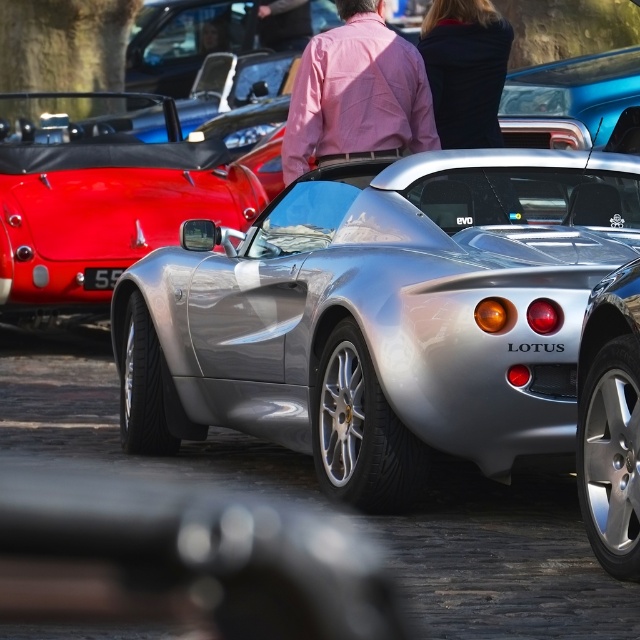
You are attending a car show and see a person wearing a pink cotton shirt at center and a black matte jacket at upper center. Which clothing item is bigger in size?

The pink cotton shirt at center is larger in size compared to the black matte jacket at upper center.

You are a photographer at the car show and want to capture both the metallic silver sports car at center and the pink cotton shirt at center in a single shot. Based on their positions, which object is closer to the camera?

The metallic silver sports car at center is below the pink cotton shirt at center, so the pink cotton shirt at center is closer to the camera.

You are standing at the center of the car show venue and see the point marked at coordinates (112, 211). Based on the scene description, which object is this point located on?

The point at coordinates (112, 211) is located on the metallic silver sports car at center.